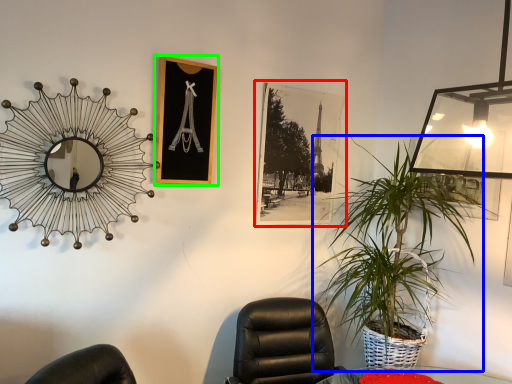
Question: Estimate the real-world distances between objects in this image. Which object is closer to picture frame (highlighted by a red box), houseplant (highlighted by a blue box) or picture frame (highlighted by a green box)?

Choices:
 (A) houseplant
 (B) picture frame

Answer: (A)